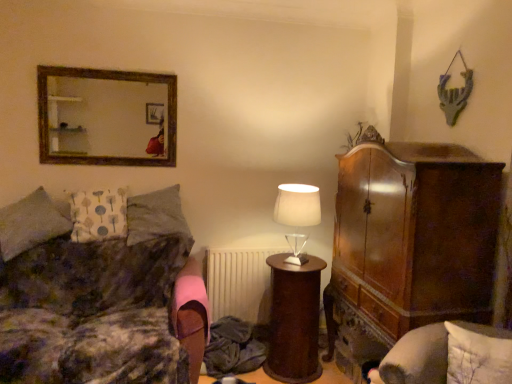
Question: Is white matte radiator at center thinner than white fabric pillow at left, which is the 3th pillow from right to left?

Choices:
 (A) yes
 (B) no

Answer: (A)

Question: Does white matte radiator at center come in front of white fabric pillow at left, which is the 3th pillow from right to left?

Choices:
 (A) no
 (B) yes

Answer: (A)

Question: Does white matte radiator at center turn towards white fabric pillow at left, which is the 3th pillow from right to left?

Choices:
 (A) no
 (B) yes

Answer: (A)

Question: Are white matte radiator at center and white fabric pillow at left, placed as the 2th pillow when sorted from left to right, beside each other?

Choices:
 (A) yes
 (B) no

Answer: (B)

Question: Is white matte radiator at center not within white fabric pillow at left, which is the 3th pillow from right to left?

Choices:
 (A) no
 (B) yes

Answer: (B)

Question: Is white matte radiator at center smaller than white fabric pillow at left, which is the 3th pillow from right to left?

Choices:
 (A) no
 (B) yes

Answer: (A)

Question: Is gray fabric pillow at left, acting as the 3th pillow starting from the left, located outside white fabric pillow at left, the 1th pillow from the left?

Choices:
 (A) yes
 (B) no

Answer: (A)

Question: Is gray fabric pillow at left, the 2th pillow positioned from the right, at the right side of white fabric pillow at left, which is counted as the 4th pillow, starting from the right?

Choices:
 (A) yes
 (B) no

Answer: (A)

Question: Can you confirm if gray fabric pillow at left, the 2th pillow positioned from the right, is thinner than white fabric pillow at left, which is counted as the 4th pillow, starting from the right?

Choices:
 (A) yes
 (B) no

Answer: (A)

Question: Does gray fabric pillow at left, the 2th pillow positioned from the right, have a greater height compared to white fabric pillow at left, which is counted as the 4th pillow, starting from the right?

Choices:
 (A) yes
 (B) no

Answer: (B)

Question: Is gray fabric pillow at left, the 2th pillow positioned from the right, shorter than white fabric pillow at left, the 1th pillow from the left?

Choices:
 (A) no
 (B) yes

Answer: (B)

Question: Is gray fabric pillow at left, the 2th pillow positioned from the right, further to the viewer compared to white fabric pillow at left, the 1th pillow from the left?

Choices:
 (A) no
 (B) yes

Answer: (B)

Question: Is velvet-like brown couch at left at the left side of wooden frame mirror at upper left?

Choices:
 (A) yes
 (B) no

Answer: (B)